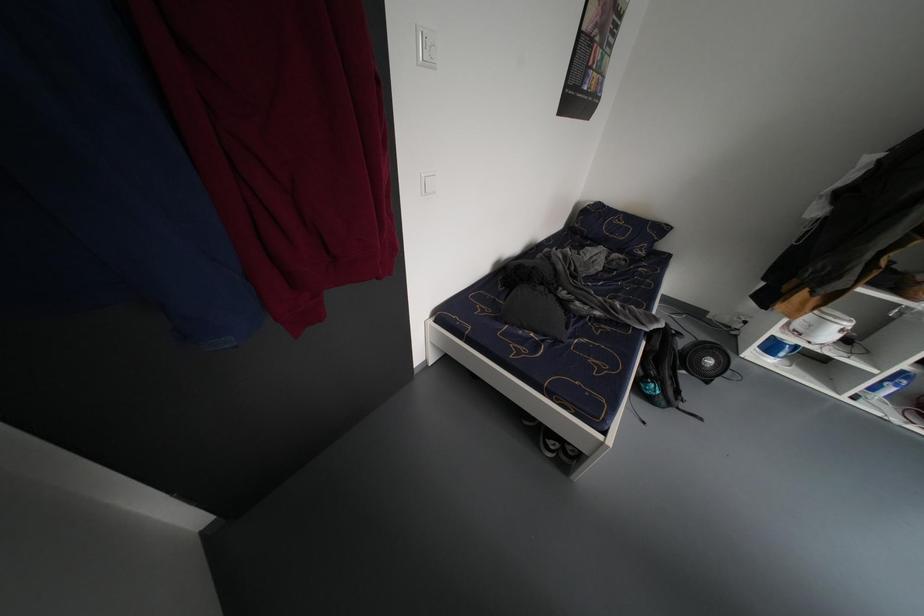
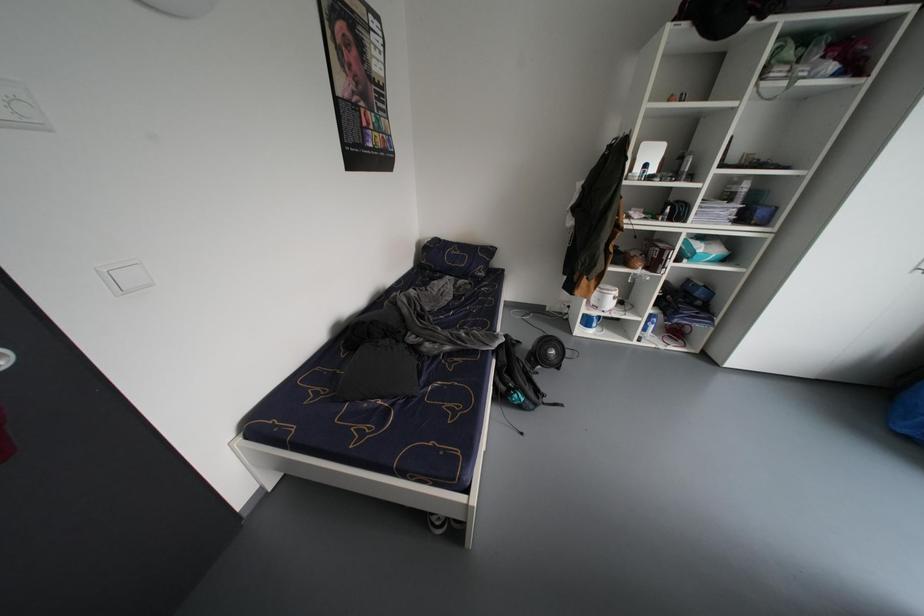
Question: The images are taken continuously from a first-person perspective. In which direction is your viewpoint rotating?

Choices:
 (A) Left
 (B) Right
 (C) Up
 (D) Down

Answer: (B)